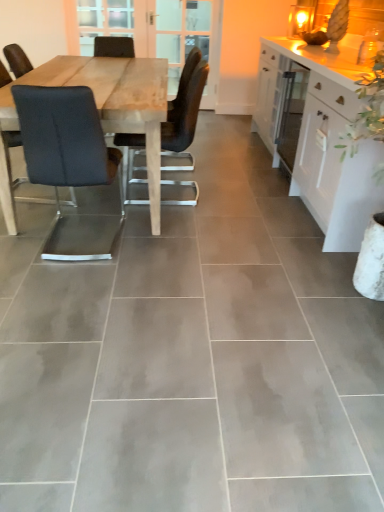
At what (x,y) coordinates should I click in order to perform the action: click on free spot below black fabric chair at left, positioned as the second chair in right-to-left order (from a real-world perspective). Please return your answer as a coordinate pair (x, y). Image resolution: width=384 pixels, height=512 pixels. Looking at the image, I should click on pos(88,246).